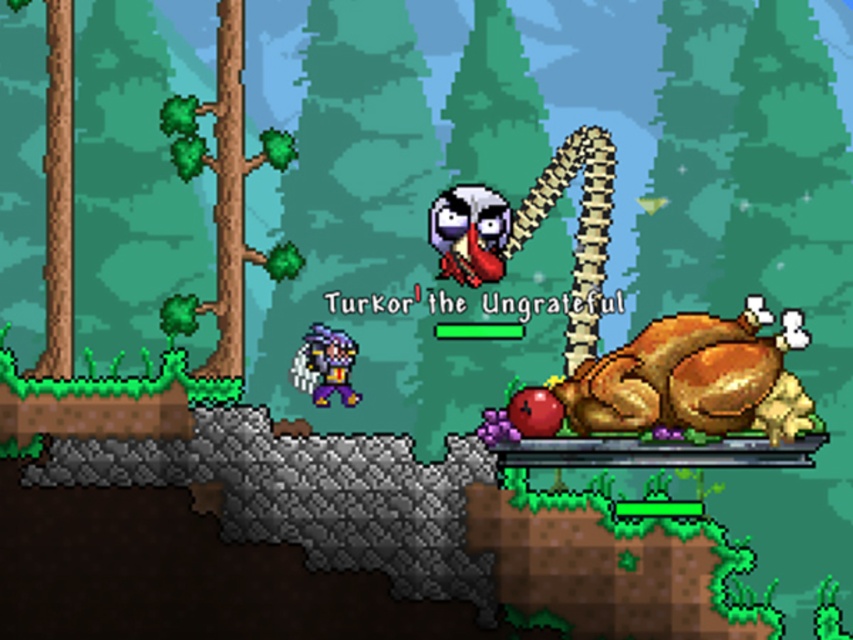
You are a character in the game who wants to pick up the golden roasted turkey at right and the green matte tree trunk at left. Which object can you reach first without moving your current position?

The golden roasted turkey at right is closer to the viewer than the green matte tree trunk at left, so you can reach the golden roasted turkey at right first without moving.

You are controlling a character in a pixel art game and need to jump from the point at coordinates point (775, 355) to the point at coordinates point (236, 364). Can you safely make this jump without falling into the gap?

Point (775, 355) is closer to the camera than point (236, 364). Since the point you are jumping from is closer, the distance between them might be larger in the game world. Therefore, the jump might not be safe as the gap could be too wide.

You are a character in the game who wants to pick up the golden roasted turkey at right and the green matte tree trunk at left. Which object is closer to your starting position if you are standing at the center of the image?

The green matte tree trunk at left is closer to your starting position because it is located to the left of the golden roasted turkey at right, which is further away on the right side of the image.